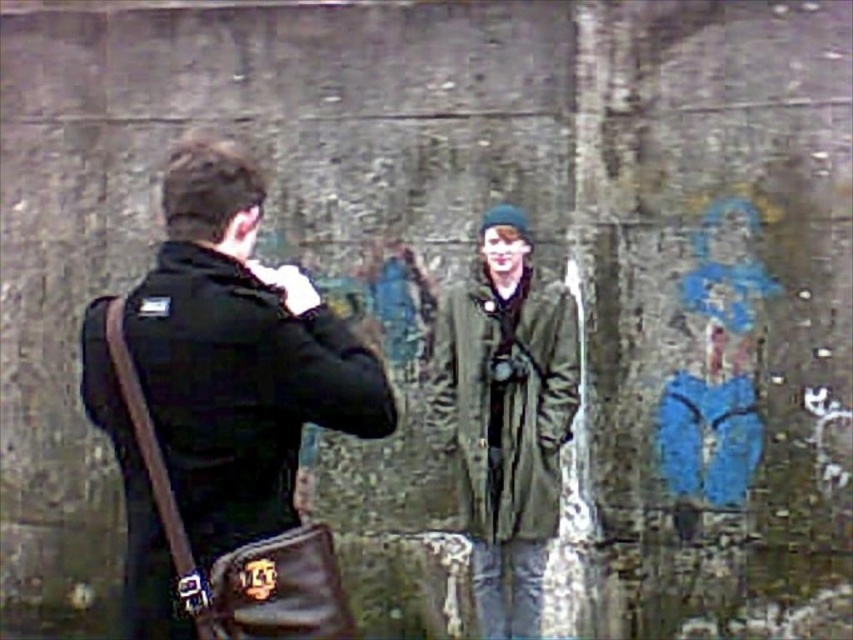
Which is behind, point (171, 529) or point (491, 492)?

Point (491, 492)

Which is in front, point (183, 448) or point (563, 417)?

Positioned in front is point (183, 448).

Where is `black leather bag at left`? black leather bag at left is located at coordinates (224, 417).